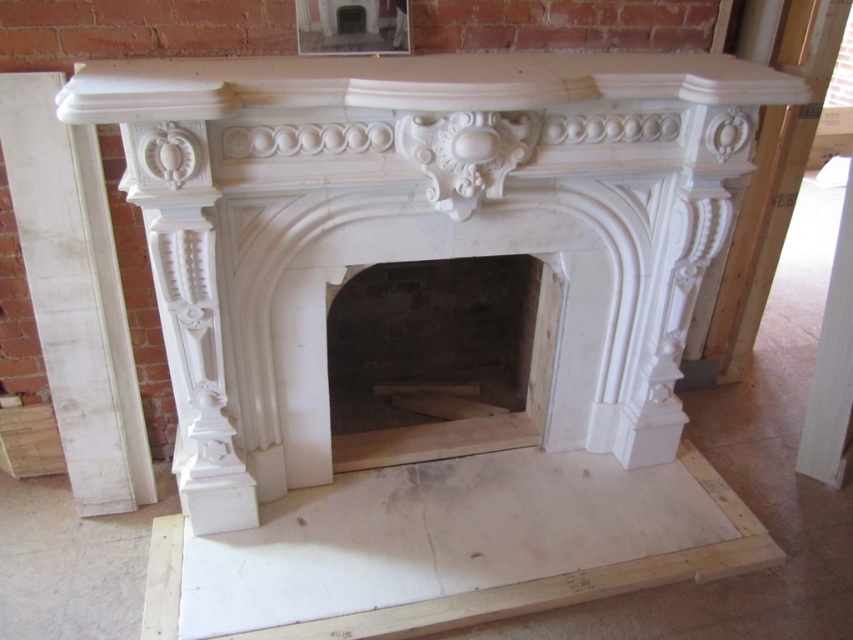
Question: Can you confirm if white marble fireplace at left is positioned below white marble fireplace at right?

Choices:
 (A) yes
 (B) no

Answer: (A)

Question: Based on their relative distances, which object is nearer to the white marble fireplace at center?

Choices:
 (A) white marble fireplace at left
 (B) white marble fireplace at right

Answer: (A)

Question: Where is white marble fireplace at center located in relation to white marble fireplace at left in the image?

Choices:
 (A) left
 (B) right

Answer: (B)

Question: Which point appears closest to the camera in this image?

Choices:
 (A) (732, 241)
 (B) (566, 435)
 (C) (123, 330)

Answer: (C)

Question: Is white marble fireplace at center below white marble fireplace at right?

Choices:
 (A) yes
 (B) no

Answer: (A)

Question: Which of these objects is positioned closest to the white marble fireplace at right?

Choices:
 (A) white marble fireplace at center
 (B) white marble fireplace at left

Answer: (A)